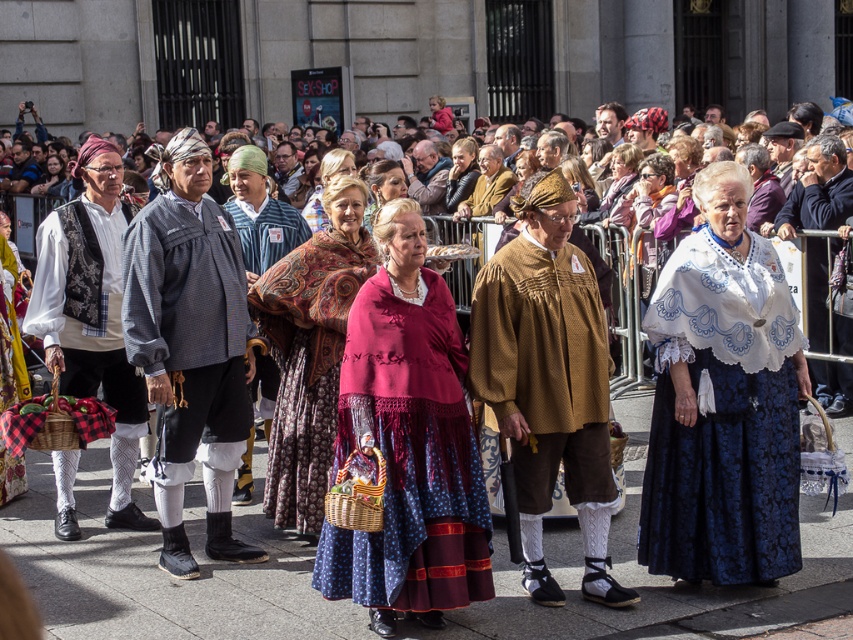
Which of these two, blue damask skirt at center or knitted wool shawl at center, stands taller?

Standing taller between the two is blue damask skirt at center.

Which is more to the left, blue damask skirt at center or knitted wool shawl at center?

Positioned to the left is knitted wool shawl at center.

Who is more distant from viewer, (740, 384) or (463, 476)?

Point (740, 384)

Image resolution: width=853 pixels, height=640 pixels. Identify the location of blue damask skirt at center. (723, 403).

Who is shorter, velvet floral dress at center or matte black headscarf at upper left?

matte black headscarf at upper left is shorter.

Is velvet floral dress at center taller than matte black headscarf at upper left?

Correct, velvet floral dress at center is much taller as matte black headscarf at upper left.

Image resolution: width=853 pixels, height=640 pixels. What do you see at coordinates (310, 353) in the screenshot? I see `velvet floral dress at center` at bounding box center [310, 353].

You are a GUI agent. You are given a task and a screenshot of the screen. Output one action in this format:
    pyautogui.click(x=<x>, y=<y>)
    Task: Click on the velvet floral dress at center
    
    Given the screenshot: What is the action you would take?
    pyautogui.click(x=310, y=353)

Does knitted wool shawl at center come in front of velvet floral dress at center?

That is True.

Which is in front, point (389, 621) or point (271, 440)?

Positioned in front is point (389, 621).

Is point (436, 564) positioned behind point (270, 438)?

That is False.

You are a GUI agent. You are given a task and a screenshot of the screen. Output one action in this format:
    pyautogui.click(x=<x>, y=<y>)
    Task: Click on the knitted wool shawl at center
    The height and width of the screenshot is (640, 853).
    Given the screenshot: What is the action you would take?
    pyautogui.click(x=408, y=442)